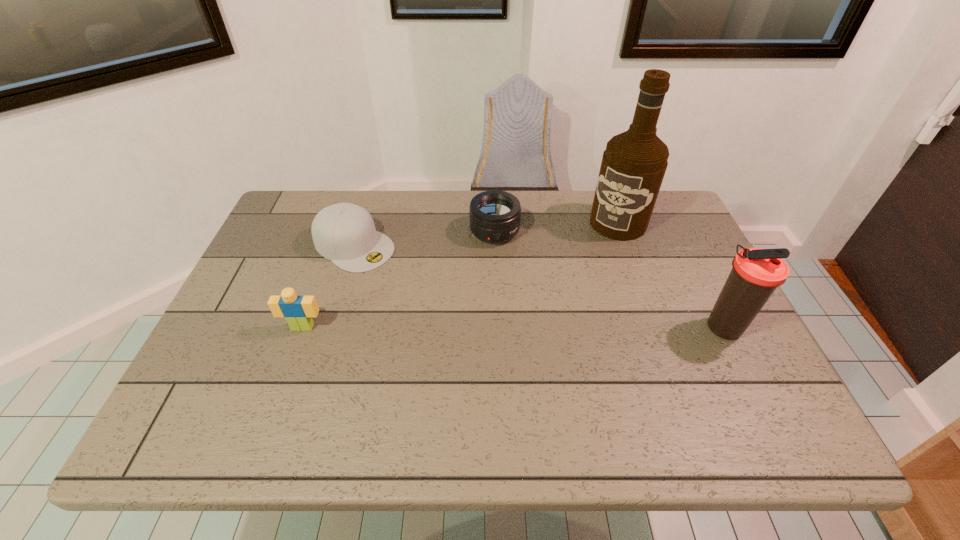
The height and width of the screenshot is (540, 960). I want to click on free space located on the front-facing side of the cap, so click(444, 301).

Locate an element on the screen. free space located on the front-facing side of the cap is located at coordinates (405, 277).

Identify the location of free spot located on the side of the third object from left to right with brand markings and control switches. (530, 329).

At what (x,y) coordinates should I click in order to perform the action: click on vacant space located on the side of the third object from left to right with brand markings and control switches. Please return your answer as a coordinate pair (x, y). Looking at the image, I should click on coord(519,302).

The image size is (960, 540). Find the location of `free spot located 0.250m on the side of the third object from left to right with brand markings and control switches`. free spot located 0.250m on the side of the third object from left to right with brand markings and control switches is located at coordinates (524, 314).

You are a GUI agent. You are given a task and a screenshot of the screen. Output one action in this format:
    pyautogui.click(x=<x>, y=<y>)
    Task: Click on the free region located 0.250m on the label of the tallest object
    
    Given the screenshot: What is the action you would take?
    pyautogui.click(x=568, y=289)

Find the location of a particular element. The height and width of the screenshot is (540, 960). free location located 0.140m on the label of the tallest object is located at coordinates (587, 265).

The height and width of the screenshot is (540, 960). Identify the location of vacant area situated 0.140m on the label of the tallest object. (587, 265).

You are a GUI agent. You are given a task and a screenshot of the screen. Output one action in this format:
    pyautogui.click(x=<x>, y=<y>)
    Task: Click on the cap at the far edge
    This screenshot has height=540, width=960.
    Given the screenshot: What is the action you would take?
    pyautogui.click(x=345, y=233)

Image resolution: width=960 pixels, height=540 pixels. Find the location of `telephoto lens that is at the far edge`. telephoto lens that is at the far edge is located at coordinates point(495,215).